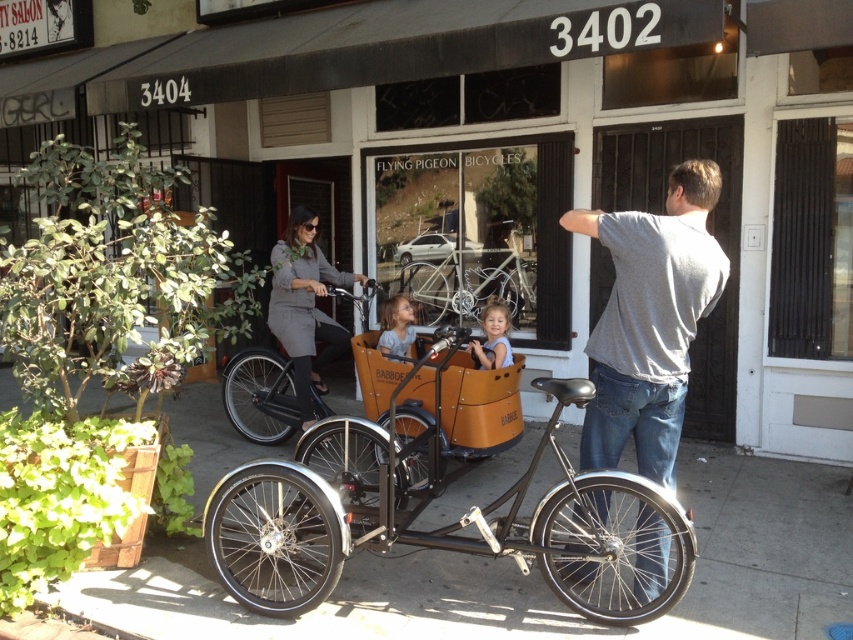
Question: Is wooden cargo bike at center positioned at the back of matte black bicycle at center?

Choices:
 (A) no
 (B) yes

Answer: (A)

Question: Which of these objects is positioned farthest from the gray cotton shirt at center?

Choices:
 (A) light blue fabric child at center
 (B) matte black bicycle at center

Answer: (B)

Question: Is matte black bicycle at center wider than light blue fabric child at center?

Choices:
 (A) yes
 (B) no

Answer: (A)

Question: Among these points, which one is nearest to the camera?

Choices:
 (A) (432, 243)
 (B) (305, 260)
 (C) (505, 362)
 (D) (619, 352)

Answer: (D)

Question: Does wooden cargo bike at center lie in front of metallic silver bicycle at center?

Choices:
 (A) yes
 (B) no

Answer: (A)

Question: Estimate the real-world distances between objects in this image. Which object is farther from the light brown wooden crate at center?

Choices:
 (A) metallic silver bicycle at center
 (B) gray matte dress at center
 (C) matte black bicycle at center

Answer: (A)